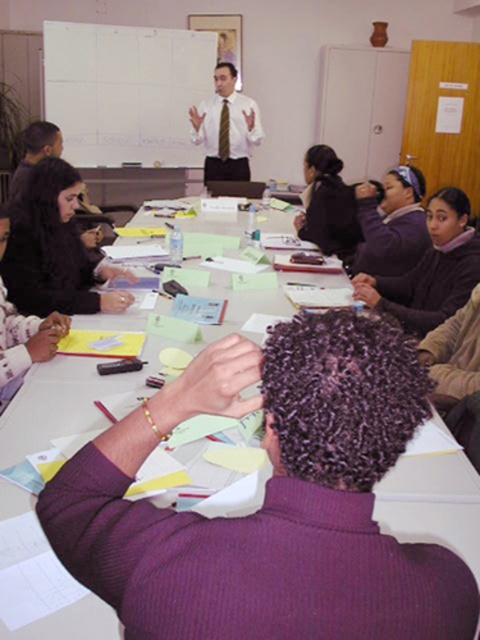
You are standing at the front of the room near the whiteboard and want to reach both the point at coordinates (201,38) and the point at coordinates (243,132). Which point is closer to you?

Point (201,38) is closer to you because it is further to the camera than point (243,132).

You are organizing a presentation and need to place a laptop on the table. The laptop is 12 inches tall. Can the white paper at center and the purple fleece jacket at upper center both fit under the laptop without being crushed?

The white paper at center is taller than the purple fleece jacket at upper center. Since the laptop is 12 inches tall, the purple fleece jacket at upper center might fit under it, but the white paper at center may be too tall to fit without being crushed.